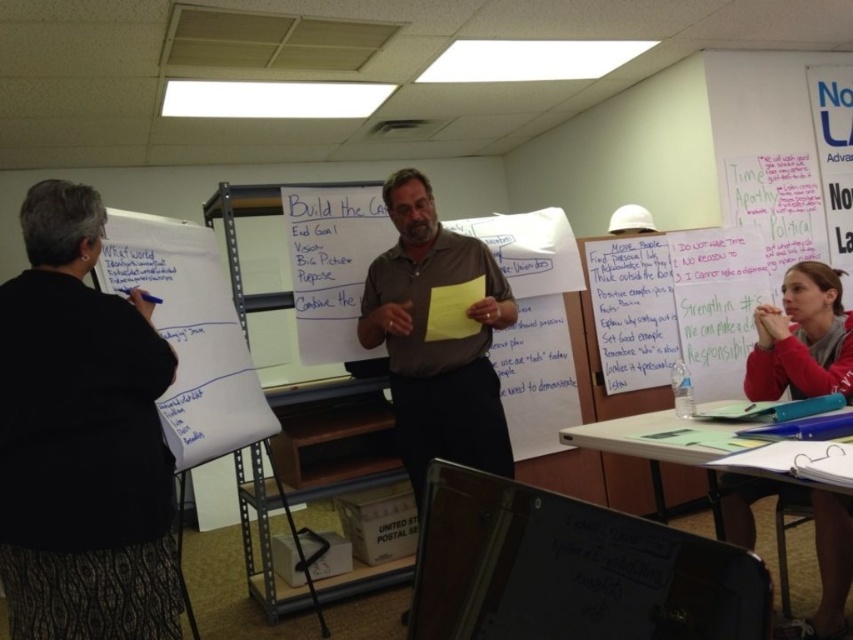
Question: Which object is positioned closest to the red fleece jacket at lower right?

Choices:
 (A) brown smooth shirt at center
 (B) black textured sweater at left
 (C) white paper at lower right

Answer: (C)

Question: Which point is farther to the camera?

Choices:
 (A) (685, 420)
 (B) (84, 340)

Answer: (A)

Question: Where is black textured sweater at left located in relation to brown smooth shirt at center in the image?

Choices:
 (A) right
 (B) left

Answer: (B)

Question: In this image, where is red fleece jacket at lower right located relative to white paper at lower right?

Choices:
 (A) above
 (B) below

Answer: (A)

Question: Which point is closer to the camera taking this photo?

Choices:
 (A) (786, 480)
 (B) (119, 404)
 (C) (849, 310)
 (D) (363, 310)

Answer: (A)

Question: Does brown smooth shirt at center lie in front of red fleece jacket at lower right?

Choices:
 (A) yes
 (B) no

Answer: (B)